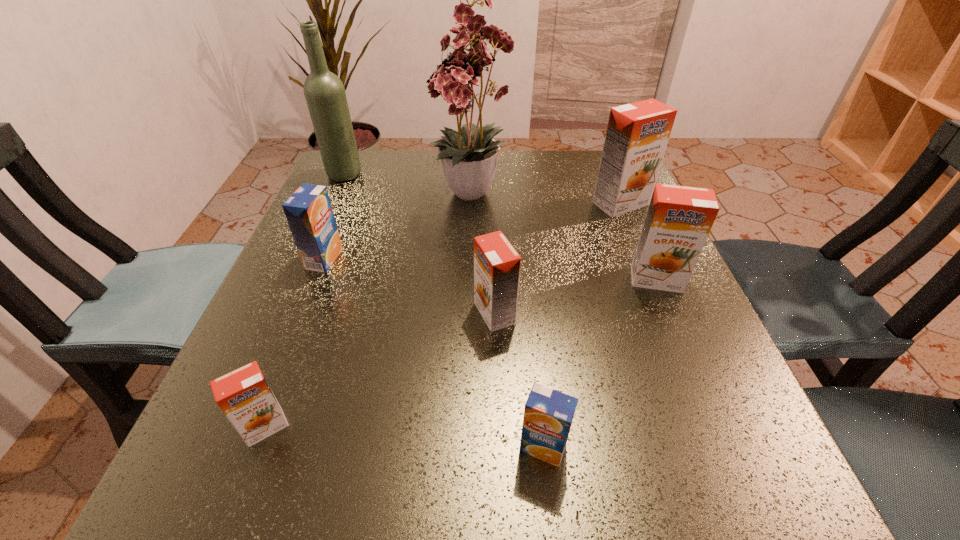
The width and height of the screenshot is (960, 540). I want to click on vacant area situated on the back of the farther blue orange_juice, so click(353, 185).

This screenshot has width=960, height=540. What are the coordinates of `blank space located on the back of the third orange orange juice from right to left` in the screenshot? It's located at (492, 214).

At what (x,y) coordinates should I click in order to perform the action: click on free region located 0.300m on the left of the right blue orange_juice. Please return your answer as a coordinate pair (x, y). Looking at the image, I should click on (289, 447).

This screenshot has width=960, height=540. I want to click on vacant space located on the right of the smallest orange orange juice, so click(525, 427).

Image resolution: width=960 pixels, height=540 pixels. Find the location of `flower arrangement that is at the far edge`. flower arrangement that is at the far edge is located at coordinates (469, 161).

I want to click on wine bottle at the far edge, so click(324, 92).

You are a GUI agent. You are given a task and a screenshot of the screen. Output one action in this format:
    pyautogui.click(x=<x>, y=<y>)
    Task: Click on the orange juice located at the far edge
    
    Given the screenshot: What is the action you would take?
    pyautogui.click(x=637, y=135)

Identify the location of wine bottle present at the left edge. (324, 92).

You are a GUI agent. You are given a task and a screenshot of the screen. Output one action in this format:
    pyautogui.click(x=<x>, y=<y>)
    Task: Click on the object located at the far left corner
    
    Given the screenshot: What is the action you would take?
    click(324, 92)

I want to click on object at the near left corner, so click(244, 396).